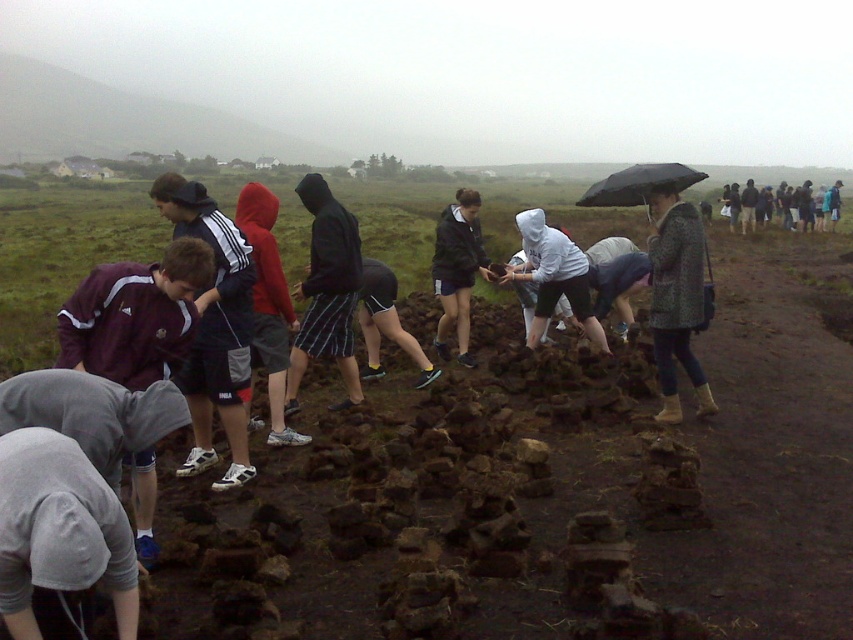
Which is below, white matte hoodie at center or black matte umbrella at upper right?

white matte hoodie at center is below.

Does white matte hoodie at center have a smaller size compared to black matte umbrella at upper right?

Yes, white matte hoodie at center is smaller than black matte umbrella at upper right.

Does point (541, 296) lie in front of point (576, 202)?

Yes, it is in front of point (576, 202).

Locate an element on the screen. The height and width of the screenshot is (640, 853). white matte hoodie at center is located at coordinates (553, 276).

In the scene shown: Which of these two, maroon jersey at lower left or patterned fabric coat at center, stands taller?

patterned fabric coat at center

Who is higher up, maroon jersey at lower left or patterned fabric coat at center?

patterned fabric coat at center is higher up.

Which is in front, point (71, 308) or point (666, 211)?

Point (71, 308)

At what (x,y) coordinates should I click in order to perform the action: click on maroon jersey at lower left. Please return your answer as a coordinate pair (x, y). Looking at the image, I should click on (135, 316).

Which of these two, gray cotton hoodie at lower left or black hooded sweatshirt at center, stands shorter?

Answer: gray cotton hoodie at lower left is shorter.

Between gray cotton hoodie at lower left and black hooded sweatshirt at center, which one has more height?

black hooded sweatshirt at center is taller.

Who is more forward, (56,483) or (346,243)?

Point (56,483) is in front.

Locate an element on the screen. The height and width of the screenshot is (640, 853). gray cotton hoodie at lower left is located at coordinates (59, 540).